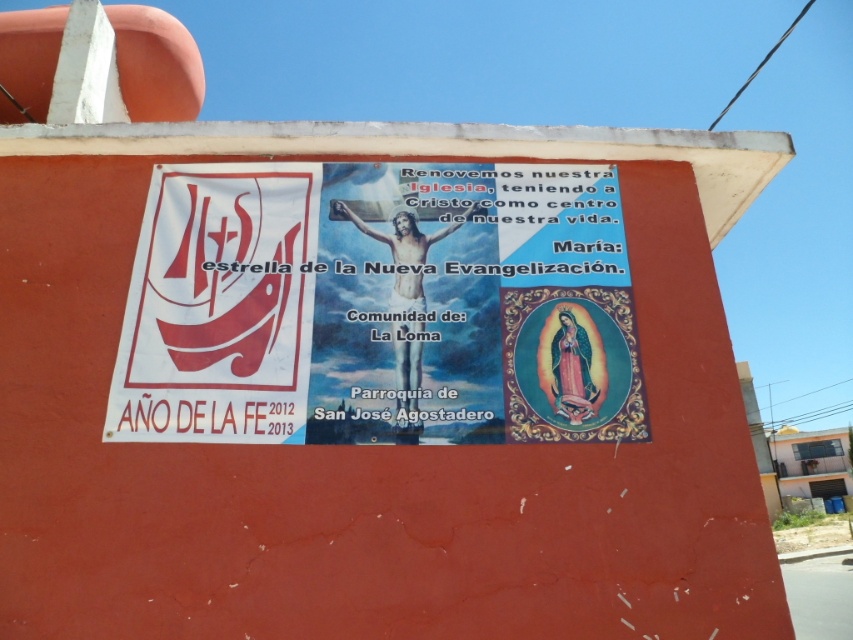
You are standing in front of a poster on a reddish wall. You see two points labeled as point 1 at coordinates (198, 490) and point 2 at coordinates (544, 205). Which point is closer to you?

Point 1 at coordinates (198, 490) is closer to the viewer than point 2 at coordinates (544, 205).